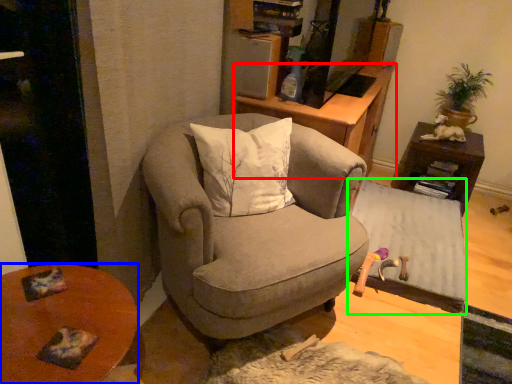
Question: Considering the real-world distances, which object is closest to cabinetry (highlighted by a red box)? desk (highlighted by a blue box) or table (highlighted by a green box).

Choices:
 (A) desk
 (B) table

Answer: (B)